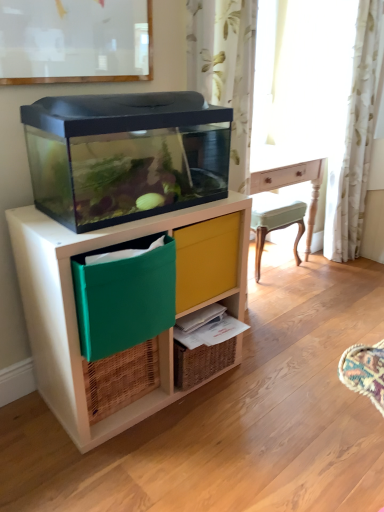
You are a GUI agent. You are given a task and a screenshot of the screen. Output one action in this format:
    pyautogui.click(x=<x>, y=<y>)
    Task: Click on the free location in front of transparent plastic aquarium at left
    The height and width of the screenshot is (512, 384).
    Given the screenshot: What is the action you would take?
    pyautogui.click(x=149, y=460)